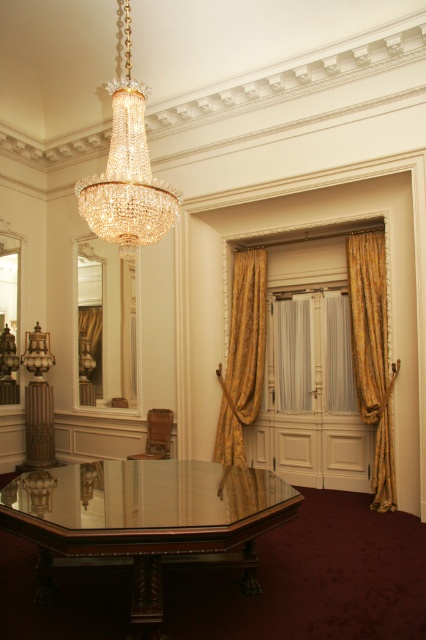
You are standing in the center of the room and want to place a small vase on the polished glass table at center. Based on the coordinates provided, can you confirm if the point marked as point (144,520) is the correct location for the table?

The polished glass table at center is represented by point (144,520), so yes, placing the vase at that coordinate will position it correctly on the table.

You are standing in the room and want to place a 3.5 meter long banner across the polished glass table at center. Can you fit the banner on the table without folding it?

The distance between the polished glass table at center and the viewer is 2.81 meters, which is shorter than the 3.5 meter banner. Therefore, the banner cannot be placed on the table without folding it.

You are planning to place a tall floor lamp in the room. Considering the polished glass table at center and the gold textured curtain at center, which object should the lamp be placed closer to to avoid hitting the ceiling?

The polished glass table at center has a lesser height compared to gold textured curtain at center, so the lamp should be placed closer to the polished glass table at center to avoid hitting the ceiling.